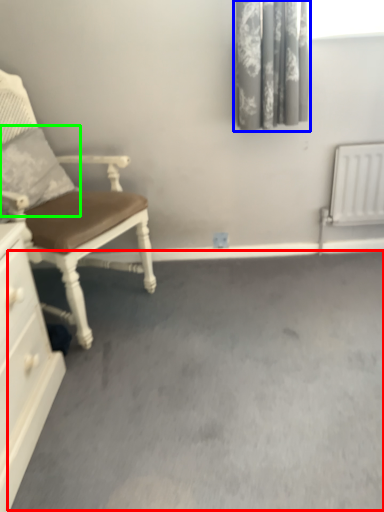
Question: Which object is positioned farthest from concrete (highlighted by a red box)? Select from curtain (highlighted by a blue box) and pillow (highlighted by a green box).

Choices:
 (A) curtain
 (B) pillow

Answer: (A)